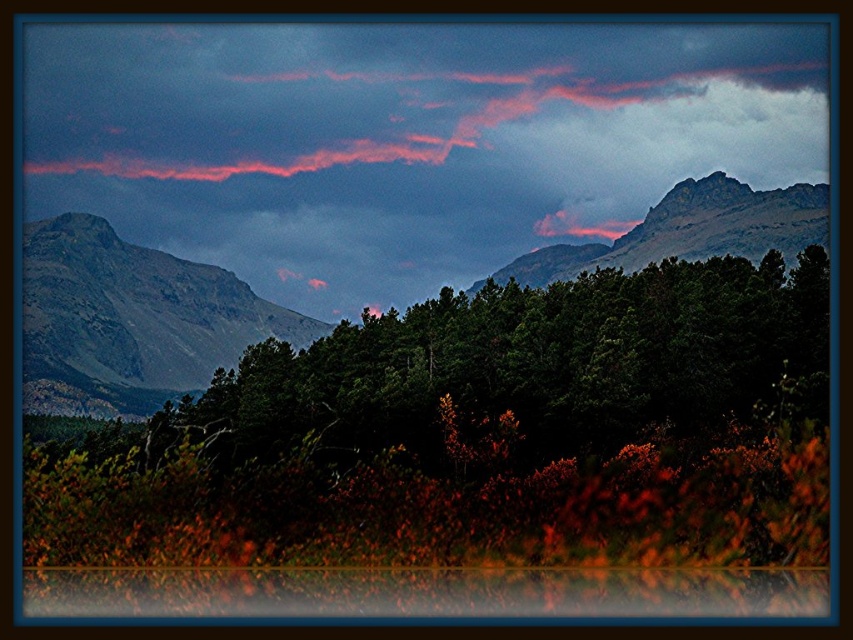
Is the position of green textured forest at center more distant than that of rugged stone mountain at left?

No, green textured forest at center is in front of rugged stone mountain at left.

Is point (712, 176) positioned behind point (132, 275)?

No.

Find the location of a particular element. Image resolution: width=853 pixels, height=640 pixels. green textured forest at center is located at coordinates (131, 321).

Between green matte tree at center and rugged stone mountain at left, which one appears on the right side from the viewer's perspective?

green matte tree at center

Which is in front, point (624, 298) or point (229, 314)?

Positioned in front is point (624, 298).

Identify the location of green matte tree at center. This screenshot has width=853, height=640. (534, 364).

Which is in front, point (379, 397) or point (598, 248)?

Positioned in front is point (379, 397).

Image resolution: width=853 pixels, height=640 pixels. What do you see at coordinates (534, 364) in the screenshot?
I see `green matte tree at center` at bounding box center [534, 364].

Where is `green matte tree at center`? green matte tree at center is located at coordinates (534, 364).